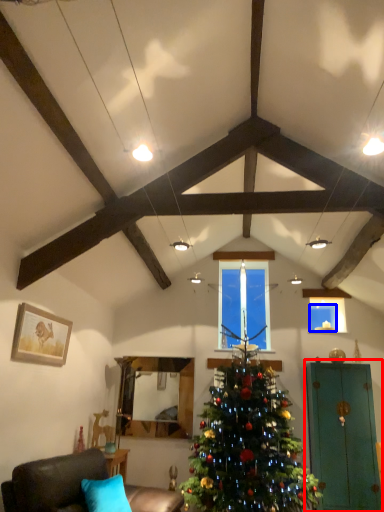
Question: Which object is closer to the camera taking this photo, armoire (highlighted by a red box) or window screen (highlighted by a blue box)?

Choices:
 (A) armoire
 (B) window screen

Answer: (A)